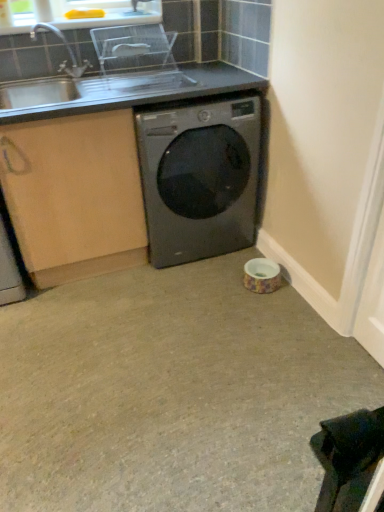
Locate an element on the screen. free space above beige carpet at center (from a real-world perspective) is located at coordinates (170, 348).